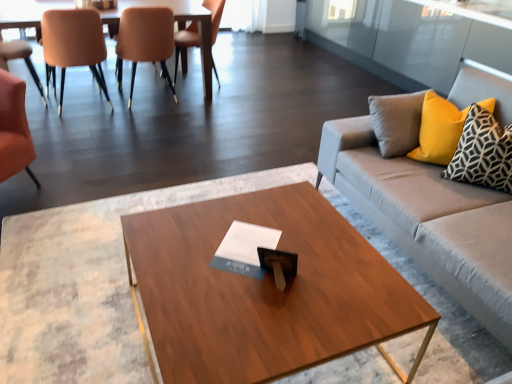
Find the location of a particular element. vacant area that is situated to the right of matte orange chair at left, the fourth chair in the left-to-right sequence is located at coordinates (197, 102).